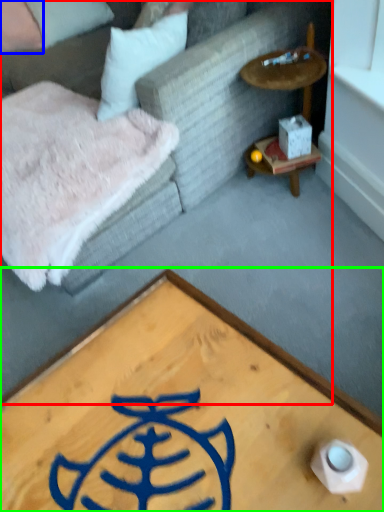
Question: Which object is positioned farthest from studio couch (highlighted by a red box)? Select from pillow (highlighted by a blue box) and coffee table (highlighted by a green box).

Choices:
 (A) pillow
 (B) coffee table

Answer: (A)